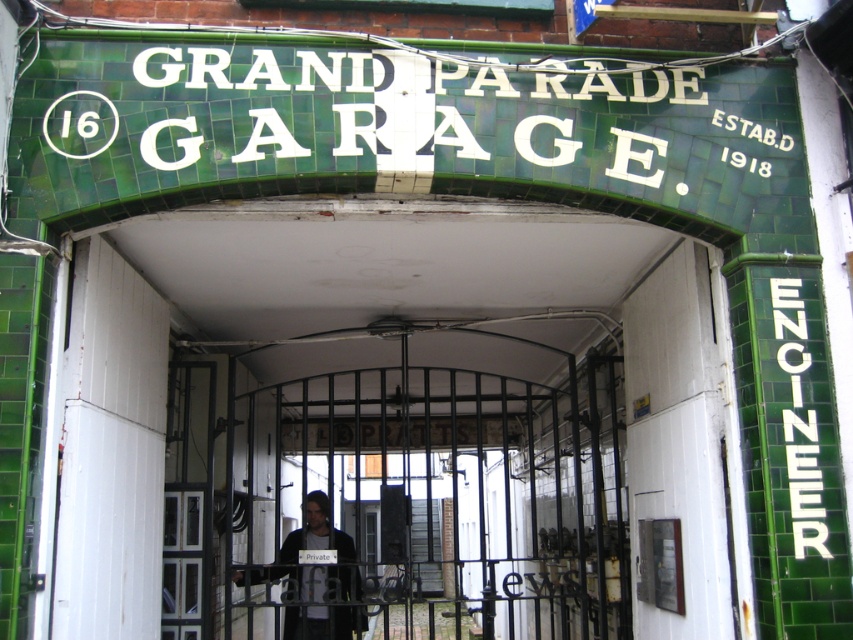
Question: Is white tile/engineer sign at right positioned before dark gray jacket at center?

Choices:
 (A) no
 (B) yes

Answer: (B)

Question: Which object is closer to the camera taking this photo?

Choices:
 (A) dark gray jacket at center
 (B) white tile/engineer sign at right

Answer: (B)

Question: Is white tile/engineer sign at right above dark gray jacket at center?

Choices:
 (A) yes
 (B) no

Answer: (A)

Question: Which of the following is the closest to the observer?

Choices:
 (A) dark gray jacket at center
 (B) white tile/engineer sign at right

Answer: (B)

Question: Among these points, which one is nearest to the camera?

Choices:
 (A) (254, 573)
 (B) (790, 339)

Answer: (B)

Question: Does white tile/engineer sign at right come behind dark gray jacket at center?

Choices:
 (A) no
 (B) yes

Answer: (A)